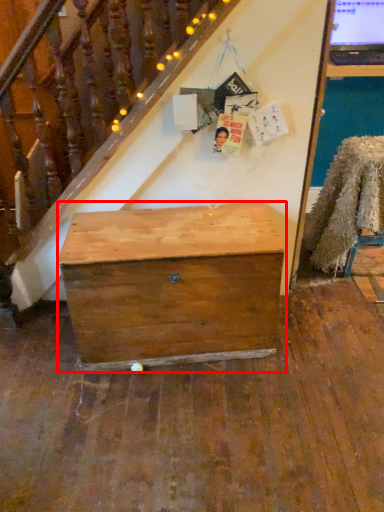
Question: In this image, where is desk (annotated by the red box) located relative to chair?

Choices:
 (A) right
 (B) left

Answer: (B)